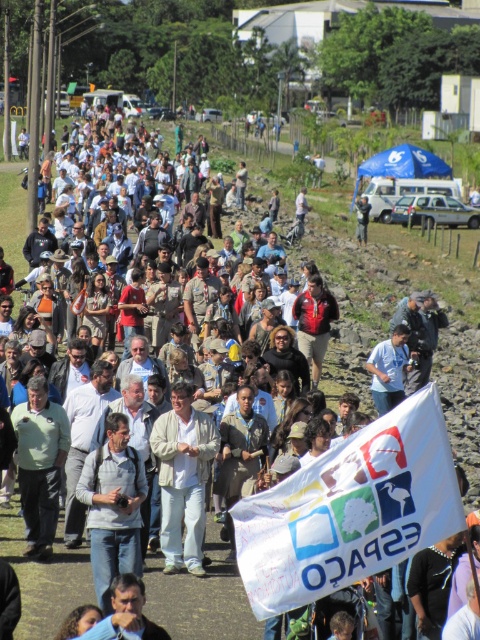
Can you confirm if white cotton shirt at center is wider than gray fabric shirt at center?

Correct, the width of white cotton shirt at center exceeds that of gray fabric shirt at center.

Does white cotton shirt at center appear on the left side of gray fabric shirt at center?

No, white cotton shirt at center is not to the left of gray fabric shirt at center.

This screenshot has width=480, height=640. What do you see at coordinates (182, 477) in the screenshot?
I see `white cotton shirt at center` at bounding box center [182, 477].

I want to click on white cotton shirt at center, so click(182, 477).

Between white fabric flag at center and gray fabric shirt at center, which one appears on the left side from the viewer's perspective?

gray fabric shirt at center

Can you confirm if white fabric flag at center is wider than gray fabric shirt at center?

Yes.

Who is more forward, [435,538] or [117,536]?

Point [435,538] is in front.

The width and height of the screenshot is (480, 640). Identify the location of white fabric flag at center. (x=350, y=509).

Is white cotton shirt at center smaller than dark blue shirt at center?

Indeed, white cotton shirt at center has a smaller size compared to dark blue shirt at center.

Can you confirm if white cotton shirt at center is wider than dark blue shirt at center?

Incorrect, white cotton shirt at center's width does not surpass dark blue shirt at center's.

Does point (192, 477) come farther from viewer compared to point (369, 204)?

No, (192, 477) is in front of (369, 204).

You are a GUI agent. You are given a task and a screenshot of the screen. Output one action in this format:
    pyautogui.click(x=<x>, y=<y>)
    Task: Click on the white cotton shirt at center
    
    Given the screenshot: What is the action you would take?
    pyautogui.click(x=182, y=477)